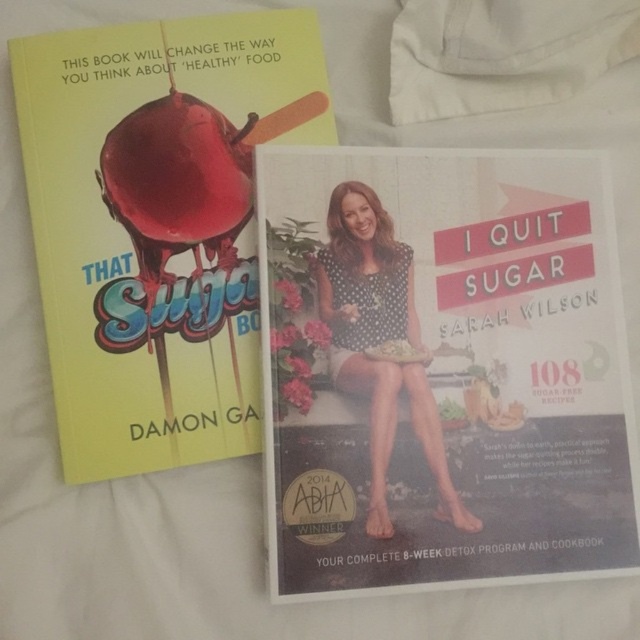
Question: Can you confirm if yellow matte book at upper left is wider than polka dot fabric at center?

Choices:
 (A) yes
 (B) no

Answer: (A)

Question: Which of these objects is positioned farthest from the yellow matte book at upper left?

Choices:
 (A) polka dot fabric at center
 (B) matte black book at lower right

Answer: (A)

Question: Does yellow matte book at upper left lie behind polka dot fabric at center?

Choices:
 (A) no
 (B) yes

Answer: (A)

Question: Among these objects, which one is nearest to the camera?

Choices:
 (A) matte black book at lower right
 (B) polka dot fabric at center
 (C) yellow matte book at upper left

Answer: (A)

Question: In this image, where is matte black book at lower right located relative to polka dot fabric at center?

Choices:
 (A) left
 (B) right

Answer: (B)

Question: Which of the following is the closest to the observer?

Choices:
 (A) matte black book at lower right
 (B) polka dot fabric at center
 (C) yellow matte book at upper left

Answer: (A)